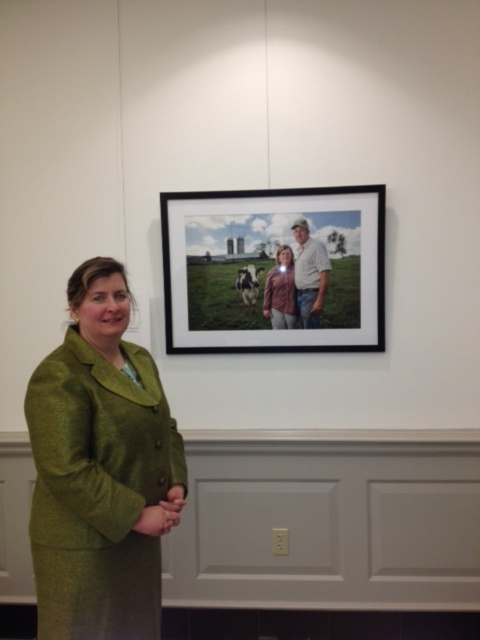
Is green woolen suit at left below matte pink shirt at center?

Correct, green woolen suit at left is located below matte pink shirt at center.

Between green woolen suit at left and matte pink shirt at center, which one appears on the right side from the viewer's perspective?

From the viewer's perspective, matte pink shirt at center appears more on the right side.

Is point (78, 609) positioned after point (278, 305)?

No, it is not.

I want to click on green woolen suit at left, so click(x=100, y=468).

Can you confirm if white cotton shirt at upper center is wider than matte pink shirt at center?

Correct, the width of white cotton shirt at upper center exceeds that of matte pink shirt at center.

Can you confirm if white cotton shirt at upper center is thinner than matte pink shirt at center?

No.

Identify the location of white cotton shirt at upper center. The height and width of the screenshot is (640, 480). (310, 275).

Where is `white cotton shirt at upper center`? white cotton shirt at upper center is located at coordinates pyautogui.click(x=310, y=275).

Does matte black frame at upper center appear on the right side of matte pink shirt at center?

Incorrect, matte black frame at upper center is not on the right side of matte pink shirt at center.

Does matte black frame at upper center have a lesser height compared to matte pink shirt at center?

Incorrect, matte black frame at upper center's height does not fall short of matte pink shirt at center's.

Does point (284, 272) come in front of point (274, 324)?

Yes, point (284, 272) is in front of point (274, 324).

Locate an element on the screen. The image size is (480, 640). matte black frame at upper center is located at coordinates (274, 269).